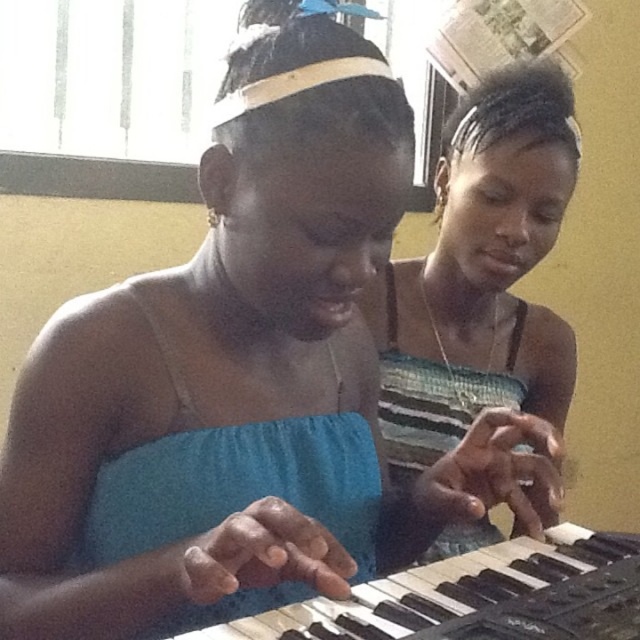
Question: Does striped fabric dress at center have a smaller size compared to black plastic keyboard at center?

Choices:
 (A) no
 (B) yes

Answer: (A)

Question: Which point is farther to the camera?

Choices:
 (A) black plastic keyboard at center
 (B) striped fabric dress at center

Answer: (B)

Question: Among these objects, which one is farthest from the camera?

Choices:
 (A) striped fabric dress at center
 (B) black plastic keyboard at center

Answer: (A)

Question: Is striped fabric dress at center thinner than black plastic keyboard at center?

Choices:
 (A) no
 (B) yes

Answer: (B)

Question: Among these objects, which one is farthest from the camera?

Choices:
 (A) black plastic keyboard at center
 (B) striped fabric dress at center

Answer: (B)

Question: Can you confirm if striped fabric dress at center is wider than black plastic keyboard at center?

Choices:
 (A) no
 (B) yes

Answer: (A)